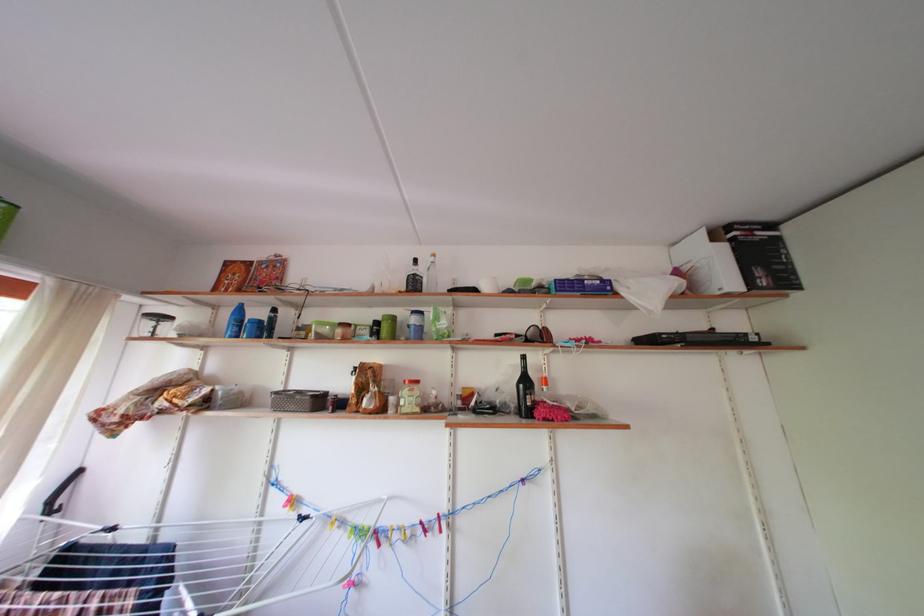
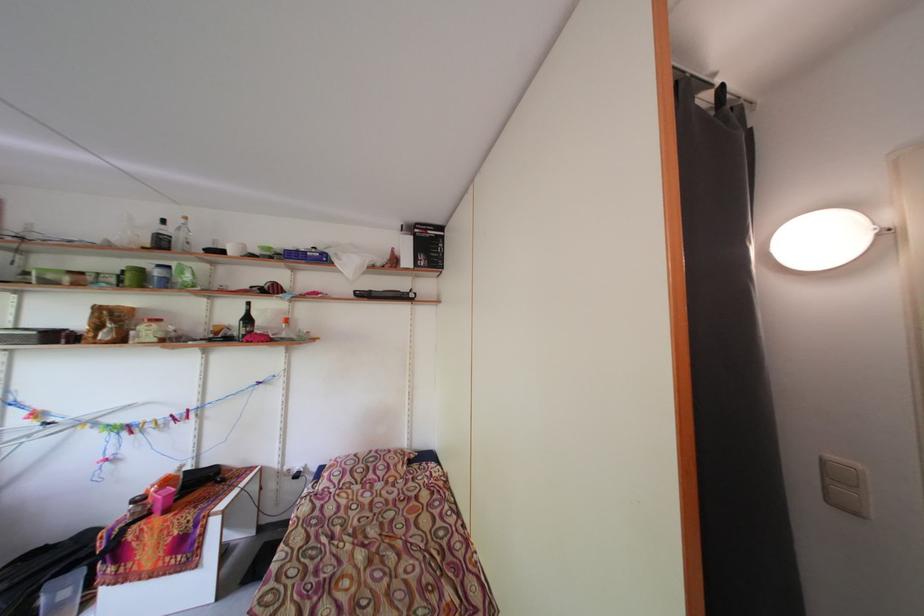
In the second image, find the point that corresponds to point 430,276 in the first image.

(176, 236)